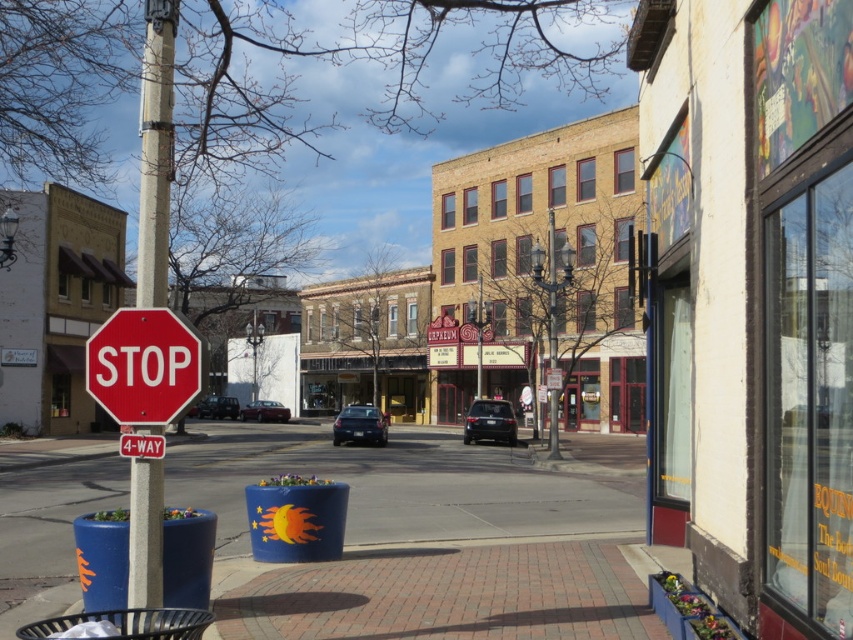
You are standing at the edge of the sidewalk and want to take a photo of the gray concrete pole at left. If your camera can focus on objects up to 5 meters away, will you need to move closer or farther away to ensure the pole is in focus?

The gray concrete pole at left is 5.32 meters away from the camera. Since the camera can focus up to 5 meters, you need to move closer to ensure the pole is within the focus range.

You are a pedestrian crossing the street and see both the red matte stop sign at left and the red plastic stop sign at center. Which one is positioned to the right side from your perspective?

The red matte stop sign at left is positioned to the right of the red plastic stop sign at center.

You are a city planner checking the safety of traffic signs. According to regulations, the distance between the gray concrete pole at left and the red matte stop sign at left must be at least 40 inches to ensure visibility. Is the current distance compliant with the regulation?

The gray concrete pole at left is 38.24 inches away from the red matte stop sign at left. Since 38.24 inches is less than the required 40 inches, the current distance does not comply with the regulation.